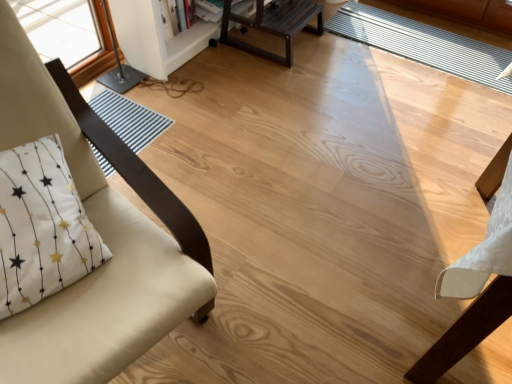
Find the location of `free space in front of dark brown wood table at upper center`. free space in front of dark brown wood table at upper center is located at coordinates (274, 79).